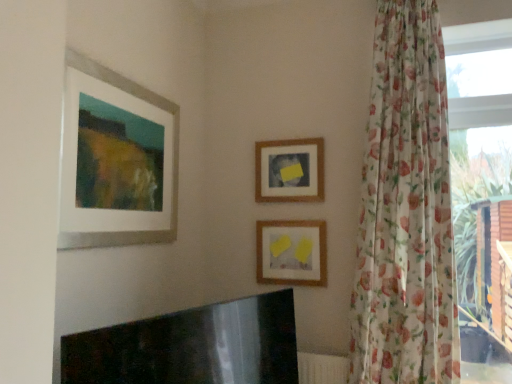
Question: Is floral sheer curtain at right at the left side of transparent floral curtain at right?

Choices:
 (A) no
 (B) yes

Answer: (B)

Question: Can you confirm if floral sheer curtain at right is positioned to the right of transparent floral curtain at right?

Choices:
 (A) yes
 (B) no

Answer: (B)

Question: Is the depth of floral sheer curtain at right less than that of transparent floral curtain at right?

Choices:
 (A) yes
 (B) no

Answer: (A)

Question: Is floral sheer curtain at right smaller than transparent floral curtain at right?

Choices:
 (A) no
 (B) yes

Answer: (A)

Question: From the image's perspective, would you say floral sheer curtain at right is positioned over transparent floral curtain at right?

Choices:
 (A) no
 (B) yes

Answer: (B)

Question: Considering the positions of floral sheer curtain at right and matte white picture frame at upper left, the 3th picture frame viewed from the back, in the image, is floral sheer curtain at right bigger or smaller than matte white picture frame at upper left, the 3th picture frame viewed from the back,?

Choices:
 (A) big
 (B) small

Answer: (A)

Question: Is point (386, 251) positioned closer to the camera than point (177, 157)?

Choices:
 (A) farther
 (B) closer

Answer: (B)

Question: Considering their positions, is floral sheer curtain at right located in front of or behind matte white picture frame at upper left, the first picture frame from the left?

Choices:
 (A) behind
 (B) front

Answer: (A)

Question: Considering the positions of floral sheer curtain at right and matte white picture frame at upper left, which appears as the third picture frame when viewed from the right, in the image, is floral sheer curtain at right taller or shorter than matte white picture frame at upper left, which appears as the third picture frame when viewed from the right,?

Choices:
 (A) short
 (B) tall

Answer: (B)

Question: Considering the relative positions of floral sheer curtain at right and matte paper picture frame at center, positioned as the first picture frame in right-to-left order, in the image provided, is floral sheer curtain at right to the left or to the right of matte paper picture frame at center, positioned as the first picture frame in right-to-left order,?

Choices:
 (A) left
 (B) right

Answer: (B)

Question: From the image's perspective, is floral sheer curtain at right positioned above or below matte paper picture frame at center, marked as the second picture frame in a back-to-front arrangement?

Choices:
 (A) above
 (B) below

Answer: (A)

Question: Looking at the image, does floral sheer curtain at right seem bigger or smaller compared to matte paper picture frame at center, marked as the 2th picture frame in a front-to-back arrangement?

Choices:
 (A) big
 (B) small

Answer: (A)

Question: Considering their positions, is floral sheer curtain at right located in front of or behind matte paper picture frame at center, marked as the 2th picture frame in a front-to-back arrangement?

Choices:
 (A) behind
 (B) front

Answer: (B)

Question: Considering the positions of transparent floral curtain at right and wooden frame at center, arranged as the third picture frame when viewed from the front, in the image, is transparent floral curtain at right taller or shorter than wooden frame at center, arranged as the third picture frame when viewed from the front,?

Choices:
 (A) tall
 (B) short

Answer: (A)

Question: In terms of size, does transparent floral curtain at right appear bigger or smaller than wooden frame at center, arranged as the third picture frame when viewed from the front?

Choices:
 (A) small
 (B) big

Answer: (B)